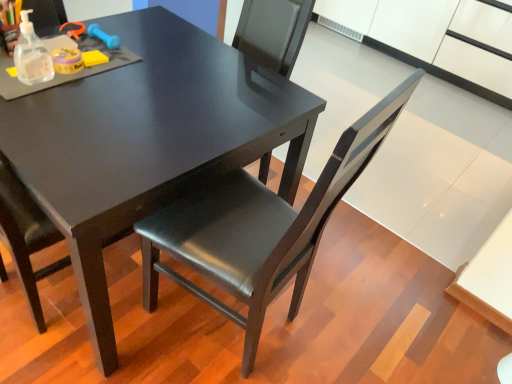
Question: Based on their sizes in the image, would you say matte black table at center is bigger or smaller than matte black chair at center?

Choices:
 (A) small
 (B) big

Answer: (B)

Question: From a real-world perspective, is matte black table at center physically located above or below matte black chair at center?

Choices:
 (A) below
 (B) above

Answer: (A)

Question: Relative to matte black chair at center, is matte black table at center in front or behind?

Choices:
 (A) front
 (B) behind

Answer: (B)

Question: From the image's perspective, is matte black chair at center positioned above or below matte black table at center?

Choices:
 (A) above
 (B) below

Answer: (B)

Question: In terms of size, does matte black chair at center appear bigger or smaller than matte black table at center?

Choices:
 (A) big
 (B) small

Answer: (B)

Question: From a real-world perspective, is matte black chair at center positioned above or below matte black table at center?

Choices:
 (A) below
 (B) above

Answer: (B)

Question: From their relative heights in the image, would you say matte black chair at center is taller or shorter than matte black table at center?

Choices:
 (A) short
 (B) tall

Answer: (B)